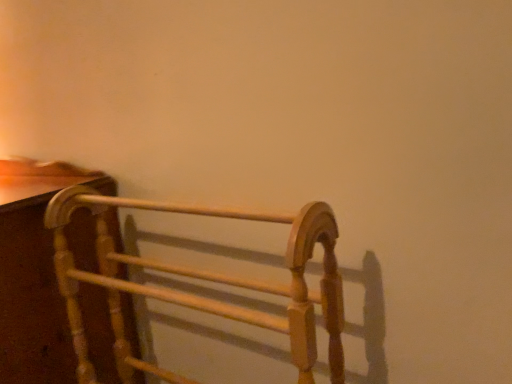
Describe the element at coordinates (35, 272) in the screenshot. I see `wooden towel rack at left, arranged as the 1th furniture when viewed from the left` at that location.

Where is `wooden towel rack at left, placed as the second furniture when sorted from right to left`? The height and width of the screenshot is (384, 512). wooden towel rack at left, placed as the second furniture when sorted from right to left is located at coordinates (35, 272).

Measure the distance between point (29, 254) and camera.

Point (29, 254) is 36.89 inches away from camera.

Describe the element at coordinates (204, 279) in the screenshot. The height and width of the screenshot is (384, 512). I see `light brown wood towel rack at left, positioned as the first furniture in right-to-left order` at that location.

Find the location of `light brown wood towel rack at left, positioned as the first furniture in right-to-left order`. light brown wood towel rack at left, positioned as the first furniture in right-to-left order is located at coordinates (204, 279).

Where is `wooden towel rack at left, placed as the second furniture when sorted from right to left`? Image resolution: width=512 pixels, height=384 pixels. wooden towel rack at left, placed as the second furniture when sorted from right to left is located at coordinates (35, 272).

Between light brown wood towel rack at left, which is the 2th furniture in left-to-right order, and wooden towel rack at left, placed as the second furniture when sorted from right to left, which one appears on the right side from the viewer's perspective?

Positioned to the right is light brown wood towel rack at left, which is the 2th furniture in left-to-right order.

From the picture: Considering their positions, is light brown wood towel rack at left, positioned as the first furniture in right-to-left order, located in front of or behind wooden towel rack at left, arranged as the 1th furniture when viewed from the left?

Clearly, light brown wood towel rack at left, positioned as the first furniture in right-to-left order, is in front of wooden towel rack at left, arranged as the 1th furniture when viewed from the left.

Does point (291, 280) come closer to viewer compared to point (40, 261)?

Yes, point (291, 280) is in front of point (40, 261).

Based on the photo, from the image's perspective, is light brown wood towel rack at left, which is the 2th furniture in left-to-right order, positioned above or below wooden towel rack at left, arranged as the 1th furniture when viewed from the left?

light brown wood towel rack at left, which is the 2th furniture in left-to-right order, is above wooden towel rack at left, arranged as the 1th furniture when viewed from the left.

From a real-world perspective, is light brown wood towel rack at left, which is the 2th furniture in left-to-right order, over wooden towel rack at left, placed as the second furniture when sorted from right to left?

Yes, from a real-world perspective, light brown wood towel rack at left, which is the 2th furniture in left-to-right order, is on top of wooden towel rack at left, placed as the second furniture when sorted from right to left.

Between light brown wood towel rack at left, which is the 2th furniture in left-to-right order, and wooden towel rack at left, arranged as the 1th furniture when viewed from the left, which one has larger width?

Wider between the two is wooden towel rack at left, arranged as the 1th furniture when viewed from the left.

Is light brown wood towel rack at left, positioned as the first furniture in right-to-left order, taller than wooden towel rack at left, placed as the second furniture when sorted from right to left?

No, light brown wood towel rack at left, positioned as the first furniture in right-to-left order, is not taller than wooden towel rack at left, placed as the second furniture when sorted from right to left.

Who is smaller, light brown wood towel rack at left, which is the 2th furniture in left-to-right order, or wooden towel rack at left, placed as the second furniture when sorted from right to left?

light brown wood towel rack at left, which is the 2th furniture in left-to-right order, is smaller.

Is light brown wood towel rack at left, which is the 2th furniture in left-to-right order, spatially inside wooden towel rack at left, arranged as the 1th furniture when viewed from the left, or outside of it?

light brown wood towel rack at left, which is the 2th furniture in left-to-right order, is outside wooden towel rack at left, arranged as the 1th furniture when viewed from the left.

Is light brown wood towel rack at left, positioned as the first furniture in right-to-left order, positioned far away from wooden towel rack at left, arranged as the 1th furniture when viewed from the left?

No.

Does light brown wood towel rack at left, positioned as the first furniture in right-to-left order, turn towards wooden towel rack at left, arranged as the 1th furniture when viewed from the left?

No, light brown wood towel rack at left, positioned as the first furniture in right-to-left order, is not facing towards wooden towel rack at left, arranged as the 1th furniture when viewed from the left.

How distant is light brown wood towel rack at left, which is the 2th furniture in left-to-right order, from wooden towel rack at left, placed as the second furniture when sorted from right to left?

light brown wood towel rack at left, which is the 2th furniture in left-to-right order, is 6.75 inches from wooden towel rack at left, placed as the second furniture when sorted from right to left.

The height and width of the screenshot is (384, 512). I want to click on furniture that is below the light brown wood towel rack at left, positioned as the first furniture in right-to-left order (from the image's perspective), so click(x=35, y=272).

Which object is positioned more to the right, wooden towel rack at left, placed as the second furniture when sorted from right to left, or light brown wood towel rack at left, positioned as the first furniture in right-to-left order?

From the viewer's perspective, light brown wood towel rack at left, positioned as the first furniture in right-to-left order, appears more on the right side.

Is wooden towel rack at left, placed as the second furniture when sorted from right to left, positioned behind light brown wood towel rack at left, positioned as the first furniture in right-to-left order?

That is True.

Does point (88, 331) lie in front of point (297, 226)?

No, it is not.

From the image's perspective, between wooden towel rack at left, arranged as the 1th furniture when viewed from the left, and light brown wood towel rack at left, positioned as the first furniture in right-to-left order, who is located below?

wooden towel rack at left, arranged as the 1th furniture when viewed from the left, appears lower in the image.

From a real-world perspective, is wooden towel rack at left, arranged as the 1th furniture when viewed from the left, physically located above or below light brown wood towel rack at left, which is the 2th furniture in left-to-right order?

wooden towel rack at left, arranged as the 1th furniture when viewed from the left, is situated lower than light brown wood towel rack at left, which is the 2th furniture in left-to-right order, in the real world.

Is wooden towel rack at left, arranged as the 1th furniture when viewed from the left, wider or thinner than light brown wood towel rack at left, positioned as the first furniture in right-to-left order?

wooden towel rack at left, arranged as the 1th furniture when viewed from the left, is wider than light brown wood towel rack at left, positioned as the first furniture in right-to-left order.

Considering the relative sizes of wooden towel rack at left, arranged as the 1th furniture when viewed from the left, and light brown wood towel rack at left, which is the 2th furniture in left-to-right order, in the image provided, is wooden towel rack at left, arranged as the 1th furniture when viewed from the left, shorter than light brown wood towel rack at left, which is the 2th furniture in left-to-right order,?

In fact, wooden towel rack at left, arranged as the 1th furniture when viewed from the left, may be taller than light brown wood towel rack at left, which is the 2th furniture in left-to-right order.

Considering the relative sizes of wooden towel rack at left, placed as the second furniture when sorted from right to left, and light brown wood towel rack at left, which is the 2th furniture in left-to-right order, in the image provided, is wooden towel rack at left, placed as the second furniture when sorted from right to left, bigger than light brown wood towel rack at left, which is the 2th furniture in left-to-right order,?

Yes.

Is light brown wood towel rack at left, positioned as the first furniture in right-to-left order, completely or partially inside wooden towel rack at left, placed as the second furniture when sorted from right to left?

No.

Are wooden towel rack at left, arranged as the 1th furniture when viewed from the left, and light brown wood towel rack at left, positioned as the first furniture in right-to-left order, located far from each other?

Actually, wooden towel rack at left, arranged as the 1th furniture when viewed from the left, and light brown wood towel rack at left, positioned as the first furniture in right-to-left order, are a little close together.

Is wooden towel rack at left, placed as the second furniture when sorted from right to left, turned away from light brown wood towel rack at left, which is the 2th furniture in left-to-right order?

No, wooden towel rack at left, placed as the second furniture when sorted from right to left,'s orientation is not away from light brown wood towel rack at left, which is the 2th furniture in left-to-right order.

This screenshot has height=384, width=512. I want to click on furniture on the left of light brown wood towel rack at left, positioned as the first furniture in right-to-left order, so click(35, 272).

Find the location of `furniture located below the light brown wood towel rack at left, which is the 2th furniture in left-to-right order (from the image's perspective)`. furniture located below the light brown wood towel rack at left, which is the 2th furniture in left-to-right order (from the image's perspective) is located at coordinates (35, 272).

This screenshot has width=512, height=384. I want to click on furniture behind the light brown wood towel rack at left, positioned as the first furniture in right-to-left order, so click(x=35, y=272).